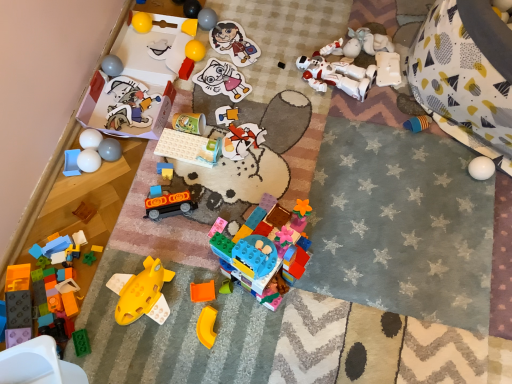
Locate an element on the screen. The image size is (512, 384). vacant area that lies between white matte robot at center, marked as the third toy in a right-to-left arrangement, and black plastic train at center, which is counted as the tenth toy, starting from the left is located at coordinates (264, 137).